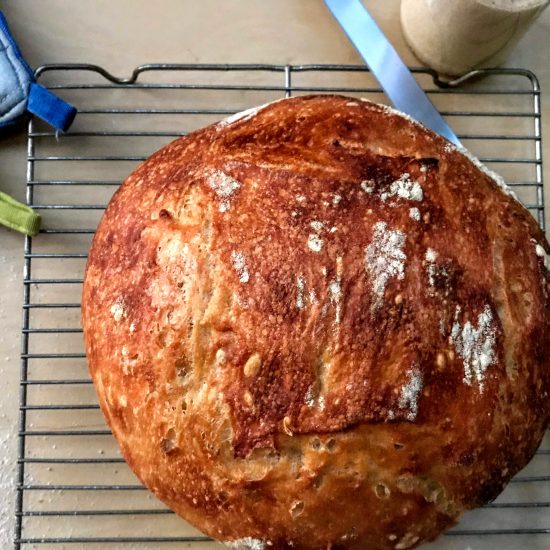
Where is `counter top`? This screenshot has width=550, height=550. counter top is located at coordinates (58, 319).